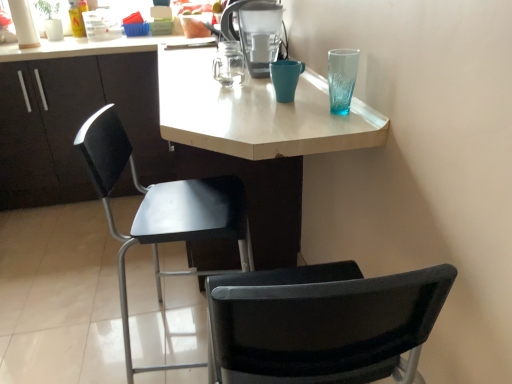
Question: From the image's perspective, is black plastic chair at center above matte plastic water filter at upper center?

Choices:
 (A) no
 (B) yes

Answer: (A)

Question: Is black plastic chair at center facing away from matte plastic water filter at upper center?

Choices:
 (A) no
 (B) yes

Answer: (A)

Question: Can you confirm if black plastic chair at center is shorter than matte plastic water filter at upper center?

Choices:
 (A) yes
 (B) no

Answer: (B)

Question: Is black plastic chair at center aimed at matte plastic water filter at upper center?

Choices:
 (A) no
 (B) yes

Answer: (A)

Question: Could matte plastic water filter at upper center be considered to be inside black plastic chair at center?

Choices:
 (A) no
 (B) yes

Answer: (A)

Question: Considering the positions of teal ceramic mug at upper center and white matte desk at center in the image, is teal ceramic mug at upper center taller or shorter than white matte desk at center?

Choices:
 (A) tall
 (B) short

Answer: (B)

Question: Based on their positions, is teal ceramic mug at upper center located to the left or right of white matte desk at center?

Choices:
 (A) right
 (B) left

Answer: (A)

Question: From a real-world perspective, is teal ceramic mug at upper center above or below white matte desk at center?

Choices:
 (A) above
 (B) below

Answer: (A)

Question: In terms of size, does teal ceramic mug at upper center appear bigger or smaller than white matte desk at center?

Choices:
 (A) big
 (B) small

Answer: (B)

Question: Does point (240, 220) appear closer or farther from the camera than point (281, 77)?

Choices:
 (A) farther
 (B) closer

Answer: (A)

Question: In terms of height, does black plastic chair at center look taller or shorter compared to teal ceramic mug at upper center?

Choices:
 (A) short
 (B) tall

Answer: (B)

Question: Is black plastic chair at center inside the boundaries of teal ceramic mug at upper center, or outside?

Choices:
 (A) inside
 (B) outside

Answer: (B)

Question: Considering the positions of black plastic chair at center and teal ceramic mug at upper center in the image, is black plastic chair at center wider or thinner than teal ceramic mug at upper center?

Choices:
 (A) wide
 (B) thin

Answer: (A)

Question: Is black plastic chair at center in front of or behind matte plastic water filter at upper center in the image?

Choices:
 (A) behind
 (B) front

Answer: (B)

Question: Choose the correct answer: Is black plastic chair at center inside matte plastic water filter at upper center or outside it?

Choices:
 (A) outside
 (B) inside

Answer: (A)